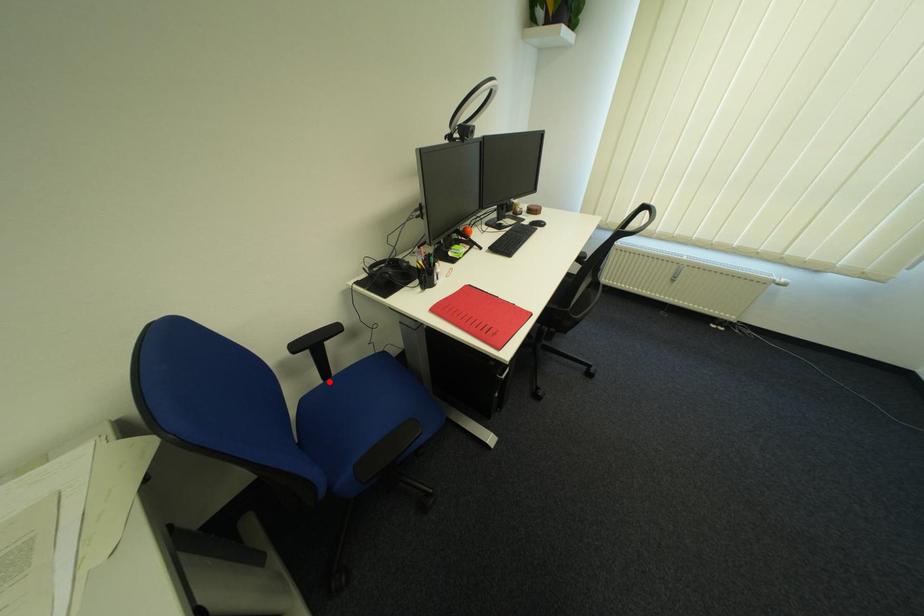
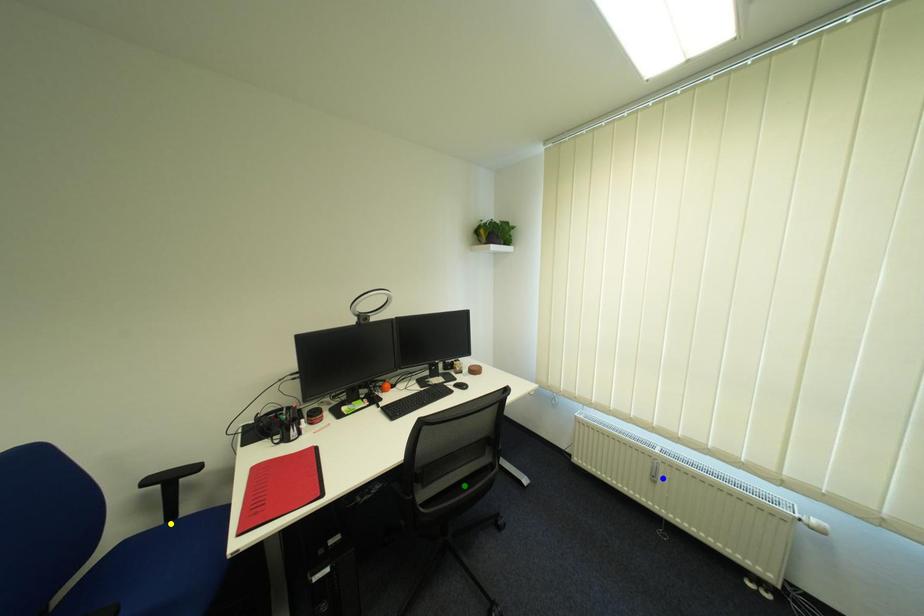
Question: I am providing you with two images of the same scene from different viewpoints. A red point is marked on the first image. You are given multiple points on the second image. Which spot in image 2 lines up with the point in image 1?

Choices:
 (A) yellow point
 (B) green point
 (C) blue point

Answer: (A)